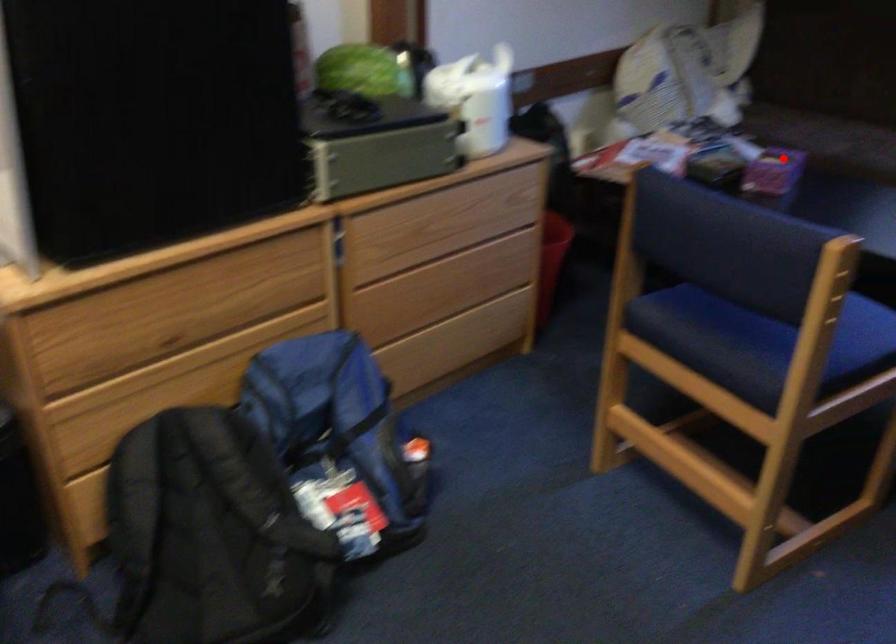
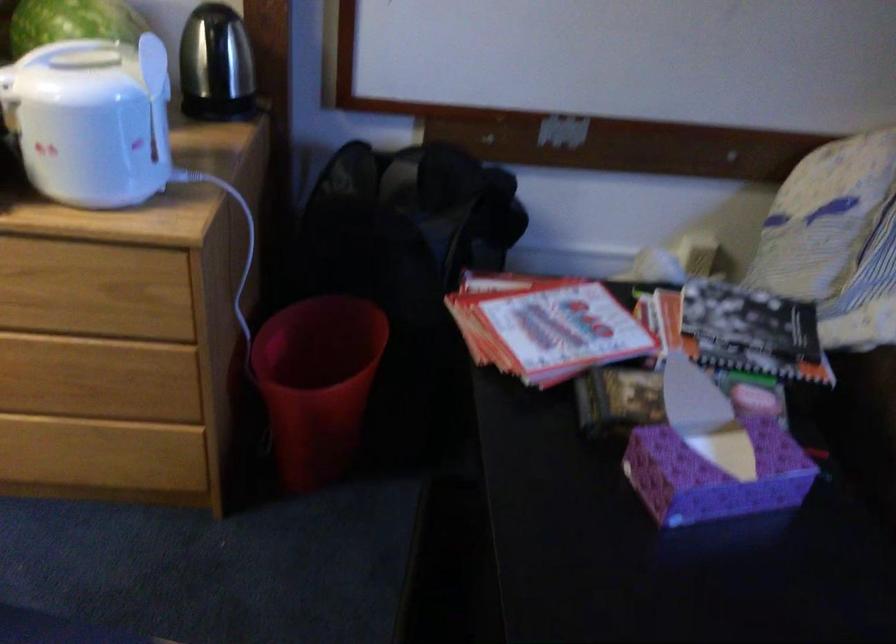
Question: I am providing you with two images of the same scene from different viewpoints. In image1, a red point is highlighted. Considering the same 3D point in image2, which of the following is correct?

Choices:
 (A) It is closer
 (B) It is farther

Answer: (A)